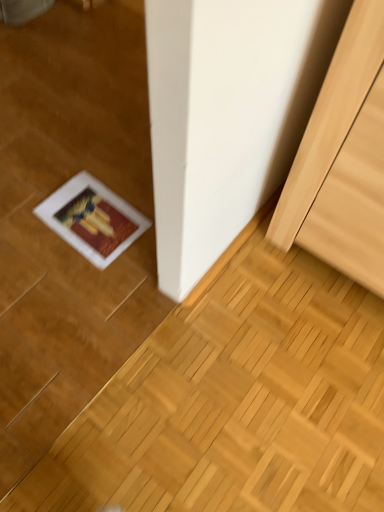
Question: Should I look upward or downward to see light wood cabinet at right?

Choices:
 (A) down
 (B) up

Answer: (B)